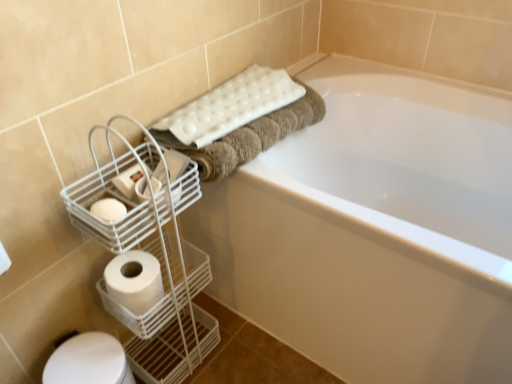
Question: From a real-world perspective, is white textured bath towel at upper center positioned over white matte toilet paper at lower left, the first toilet paper ordered from the bottom, based on gravity?

Choices:
 (A) yes
 (B) no

Answer: (A)

Question: From the image's perspective, is white textured bath towel at upper center over white matte toilet paper at lower left, the first toilet paper ordered from the bottom?

Choices:
 (A) yes
 (B) no

Answer: (A)

Question: Is white textured bath towel at upper center thinner than white matte toilet paper at lower left, the second toilet paper when ordered from top to bottom?

Choices:
 (A) yes
 (B) no

Answer: (B)

Question: Is the position of white textured bath towel at upper center less distant than that of white matte toilet paper at lower left, the second toilet paper when ordered from top to bottom?

Choices:
 (A) yes
 (B) no

Answer: (B)

Question: Does white textured bath towel at upper center have a greater height compared to white matte toilet paper at lower left, the first toilet paper ordered from the bottom?

Choices:
 (A) no
 (B) yes

Answer: (A)

Question: Is white glossy bathtub at upper center spatially inside white textured bath towel at upper center, or outside of it?

Choices:
 (A) inside
 (B) outside

Answer: (B)

Question: Considering the positions of white glossy bathtub at upper center and white textured bath towel at upper center in the image, is white glossy bathtub at upper center bigger or smaller than white textured bath towel at upper center?

Choices:
 (A) small
 (B) big

Answer: (B)

Question: From the image's perspective, is white glossy bathtub at upper center above or below white textured bath towel at upper center?

Choices:
 (A) above
 (B) below

Answer: (B)

Question: Looking at their shapes, would you say white glossy bathtub at upper center is wider or thinner than white textured bath towel at upper center?

Choices:
 (A) thin
 (B) wide

Answer: (B)

Question: Relative to white wire basket at left, is white matte toilet paper at lower left, the first toilet paper ordered from the bottom, in front or behind?

Choices:
 (A) behind
 (B) front

Answer: (A)

Question: From the image's perspective, is white matte toilet paper at lower left, the second toilet paper when ordered from top to bottom, located above or below white wire basket at left?

Choices:
 (A) above
 (B) below

Answer: (B)

Question: Is point (145, 258) positioned closer to the camera than point (137, 246)?

Choices:
 (A) farther
 (B) closer

Answer: (A)

Question: In terms of width, does white matte toilet paper at lower left, the second toilet paper when ordered from top to bottom, look wider or thinner when compared to white wire basket at left?

Choices:
 (A) thin
 (B) wide

Answer: (A)

Question: From the image's perspective, is white wire basket at left positioned above or below white glossy bathtub at upper center?

Choices:
 (A) above
 (B) below

Answer: (B)

Question: Based on their sizes in the image, would you say white wire basket at left is bigger or smaller than white glossy bathtub at upper center?

Choices:
 (A) small
 (B) big

Answer: (A)